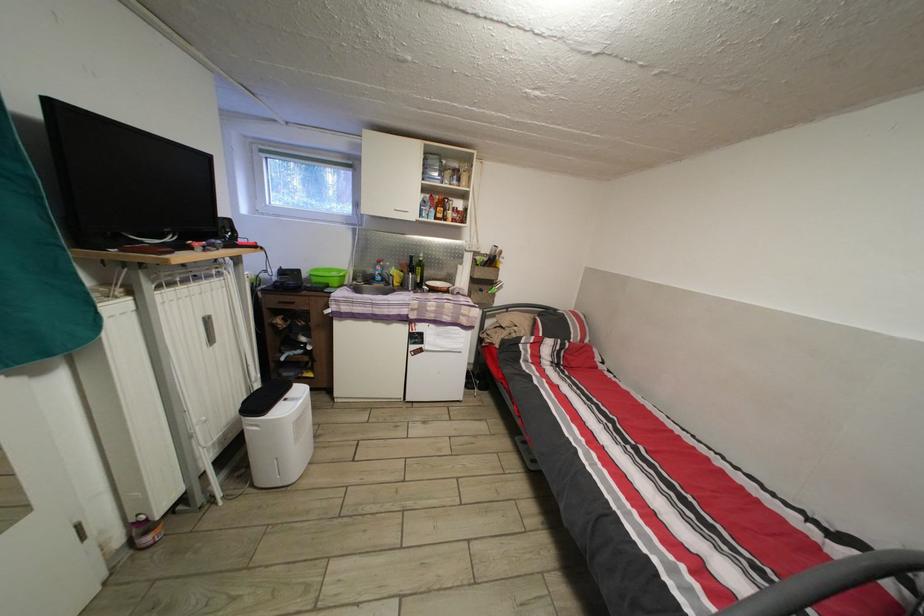
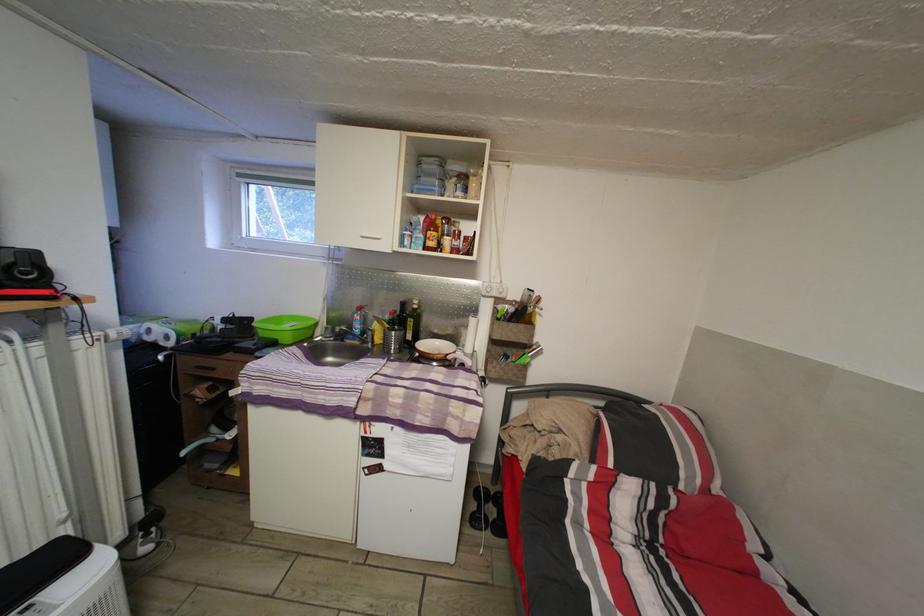
Locate, in the second image, the point that corresponds to [426,286] in the first image.

(417, 344)